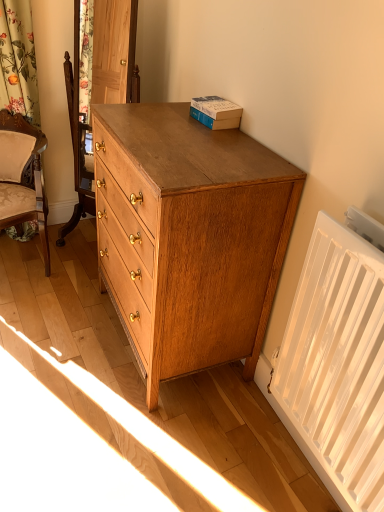
In order to face hardcover book at upper right, should I rotate leftwards or rightwards?

Rotate right and turn 3.451 degrees.

This screenshot has width=384, height=512. What do you see at coordinates (26, 186) in the screenshot?
I see `beige upholstered chair at left` at bounding box center [26, 186].

At what (x,y) coordinates should I click in order to perform the action: click on white plastic radiator at lower right. Please return your answer as a coordinate pair (x, y). Image resolution: width=384 pixels, height=512 pixels. Looking at the image, I should click on (337, 364).

At what (x,y) coordinates should I click in order to perform the action: click on hardcover book at upper right. Please return your answer as a coordinate pair (x, y). This screenshot has height=512, width=384. Looking at the image, I should click on (216, 112).

Can you see white plastic radiator at lower right touching beige upholstered chair at left?

white plastic radiator at lower right and beige upholstered chair at left are clearly separated.

From the picture: Between white plastic radiator at lower right and beige upholstered chair at left, which one is positioned in front?

white plastic radiator at lower right is closer to the camera.

From the image's perspective, is white plastic radiator at lower right located above beige upholstered chair at left?

Incorrect, from the image's perspective, white plastic radiator at lower right is lower than beige upholstered chair at left.

Looking at the image, does white plastic radiator at lower right seem bigger or smaller compared to beige upholstered chair at left?

white plastic radiator at lower right is smaller than beige upholstered chair at left.

Is hardcover book at upper right oriented towards beige upholstered chair at left?

No, hardcover book at upper right is not oriented towards beige upholstered chair at left.

Considering the sizes of objects hardcover book at upper right and beige upholstered chair at left in the image provided, who is shorter, hardcover book at upper right or beige upholstered chair at left?

With less height is hardcover book at upper right.

Does point (217, 100) appear closer or farther from the camera than point (25, 187)?

Point (217, 100) is positioned closer to the camera compared to point (25, 187).

Who is smaller, white plastic radiator at lower right or hardcover book at upper right?

hardcover book at upper right.

From a real-world perspective, is white plastic radiator at lower right located beneath hardcover book at upper right?

Yes, from a real-world perspective, white plastic radiator at lower right is below hardcover book at upper right.

Would you say white plastic radiator at lower right is a long distance from hardcover book at upper right?

No.

How many degrees apart are the facing directions of white plastic radiator at lower right and hardcover book at upper right?

They differ by 2.6 degrees in their facing directions.

From the image's perspective, is beige upholstered chair at left over white plastic radiator at lower right?

Indeed, from the image's perspective, beige upholstered chair at left is shown above white plastic radiator at lower right.

Is beige upholstered chair at left not within white plastic radiator at lower right?

Yes, beige upholstered chair at left is outside of white plastic radiator at lower right.

Is beige upholstered chair at left turned away from white plastic radiator at lower right?

That's not correct — beige upholstered chair at left is not looking away from white plastic radiator at lower right.

From a real-world perspective, is beige upholstered chair at left located higher than white plastic radiator at lower right?

No.

Is hardcover book at upper right in front of or behind white plastic radiator at lower right in the image?

hardcover book at upper right is behind white plastic radiator at lower right.

Is hardcover book at upper right looking in the opposite direction of white plastic radiator at lower right?

hardcover book at upper right is not turned away from white plastic radiator at lower right.

Is point (233, 125) more distant than point (299, 414)?

Yes.

Can you confirm if hardcover book at upper right is bigger than white plastic radiator at lower right?

Actually, hardcover book at upper right might be smaller than white plastic radiator at lower right.

Considering the positions of point (243, 283) and point (368, 387), is point (243, 283) closer or farther from the camera than point (368, 387)?

Clearly, point (243, 283) is more distant from the camera than point (368, 387).

How different are the orientations of matte oak chest of drawers at right and white plastic radiator at lower right in degrees?

The angular difference between matte oak chest of drawers at right and white plastic radiator at lower right is 0.0529 degrees.

Is matte oak chest of drawers at right in front of white plastic radiator at lower right?

No, it is behind white plastic radiator at lower right.

Are matte oak chest of drawers at right and white plastic radiator at lower right far apart?

No, matte oak chest of drawers at right is not far away from white plastic radiator at lower right.

Is point (323, 460) positioned after point (229, 313)?

No, it is not.

Considering the sizes of objects white plastic radiator at lower right and matte oak chest of drawers at right in the image provided, who is bigger, white plastic radiator at lower right or matte oak chest of drawers at right?

With larger size is matte oak chest of drawers at right.

From a real-world perspective, between white plastic radiator at lower right and matte oak chest of drawers at right, who is vertically lower?

matte oak chest of drawers at right.

Considering the relative sizes of white plastic radiator at lower right and matte oak chest of drawers at right in the image provided, is white plastic radiator at lower right shorter than matte oak chest of drawers at right?

Yes, white plastic radiator at lower right is shorter than matte oak chest of drawers at right.

Find the location of a particular element. chair to the left of white plastic radiator at lower right is located at coordinates (26, 186).

The width and height of the screenshot is (384, 512). What are the coordinates of `book above the beige upholstered chair at left (from the image's perspective)` in the screenshot? It's located at (216, 112).

Considering their positions, is white plastic radiator at lower right positioned further to matte oak chest of drawers at right than beige upholstered chair at left?

beige upholstered chair at left.

Looking at the image, which one is located further to hardcover book at upper right, beige upholstered chair at left or white plastic radiator at lower right?

Based on the image, beige upholstered chair at left appears to be further to hardcover book at upper right.

When comparing their distances from matte oak chest of drawers at right, does beige upholstered chair at left or white plastic radiator at lower right seem closer?

Among the two, white plastic radiator at lower right is located nearer to matte oak chest of drawers at right.

Which object lies nearer to the anchor point matte oak chest of drawers at right, beige upholstered chair at left or hardcover book at upper right?

Based on the image, hardcover book at upper right appears to be nearer to matte oak chest of drawers at right.

Estimate the real-world distances between objects in this image. Which object is closer to beige upholstered chair at left, hardcover book at upper right or white plastic radiator at lower right?

The object closer to beige upholstered chair at left is hardcover book at upper right.

Which object lies further to the anchor point white plastic radiator at lower right, matte oak chest of drawers at right or hardcover book at upper right?

The object further to white plastic radiator at lower right is hardcover book at upper right.

Looking at this image, based on their spatial positions, is beige upholstered chair at left or hardcover book at upper right further from white plastic radiator at lower right?

beige upholstered chair at left is further to white plastic radiator at lower right.

Looking at the image, which one is located further to hardcover book at upper right, matte oak chest of drawers at right or white plastic radiator at lower right?

white plastic radiator at lower right.

In order to click on the chest of drawers located between beige upholstered chair at left and hardcover book at upper right in the left-right direction in this screenshot , I will do `click(189, 234)`.

The height and width of the screenshot is (512, 384). In order to click on the chest of drawers between hardcover book at upper right and white plastic radiator at lower right vertically in this screenshot , I will do `click(189, 234)`.

Where is `book located between beige upholstered chair at left and white plastic radiator at lower right in the left-right direction`? book located between beige upholstered chair at left and white plastic radiator at lower right in the left-right direction is located at coordinates (216, 112).

Find the location of `chest of drawers between beige upholstered chair at left and white plastic radiator at lower right from left to right`. chest of drawers between beige upholstered chair at left and white plastic radiator at lower right from left to right is located at coordinates (189, 234).